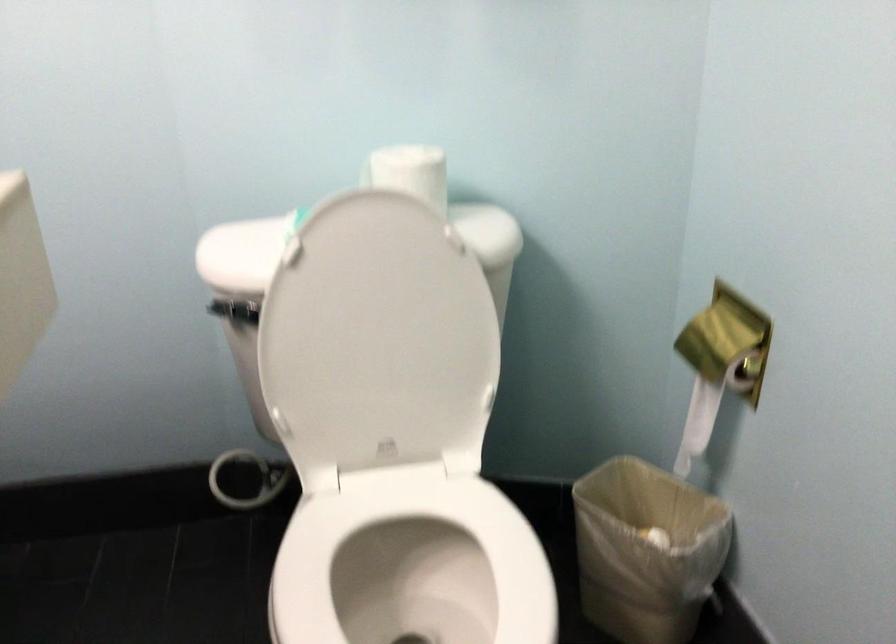
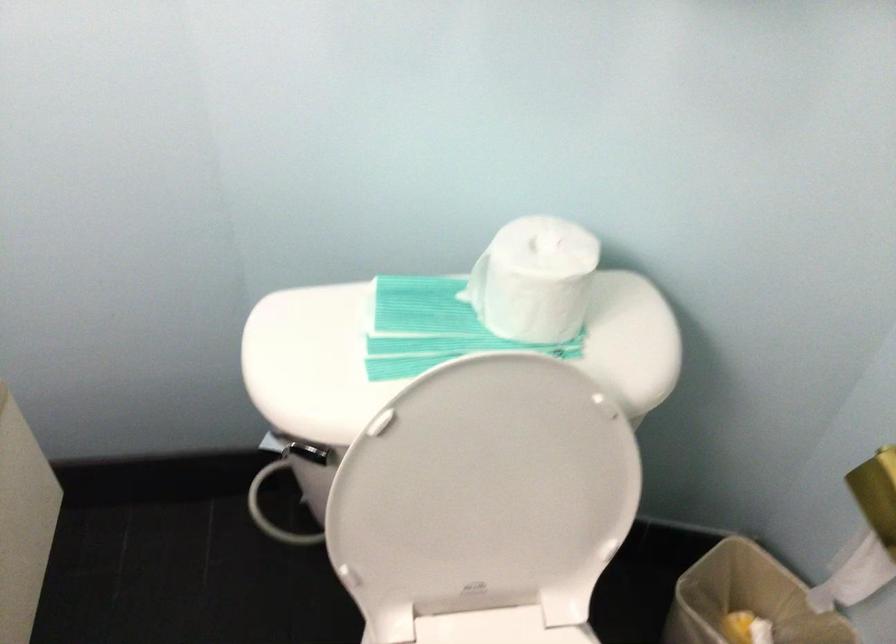
In a continuous first-person perspective shot, in which direction is the camera moving?

The cameraman walked toward left, forward.